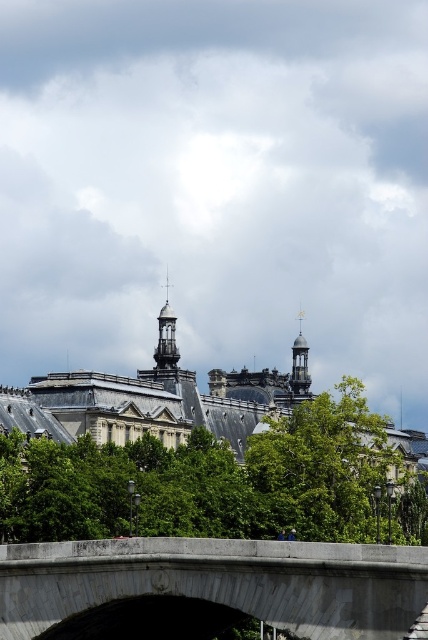
You are standing at the base of the historic building complex and see two points marked in the image. Which point, point [41,586] or point [309,380], is closer to you?

Point [41,586] is closer to the viewer than point [309,380].

Based on the photo, you are a tourist standing at the base of the gold metallic clock tower at upper right and want to cross the gray concrete bridge at center. Which direction should you walk to reach the bridge from the tower?

The gray concrete bridge at center is shorter than the gold metallic clock tower at upper right. To reach the bridge, you should walk towards the center of the image, away from the tower, since the bridge is positioned lower and closer to the foreground compared to the tower located at the upper right.